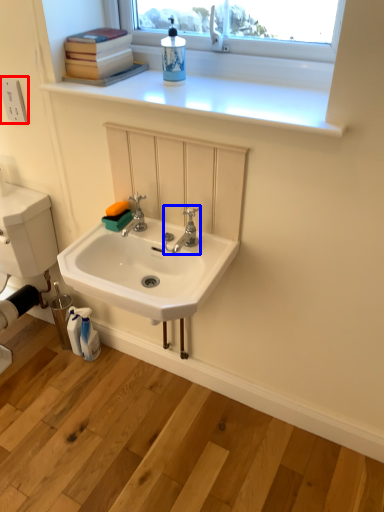
Question: Which object is further to the camera taking this photo, electric outlet (highlighted by a red box) or tap (highlighted by a blue box)?

Choices:
 (A) electric outlet
 (B) tap

Answer: (A)